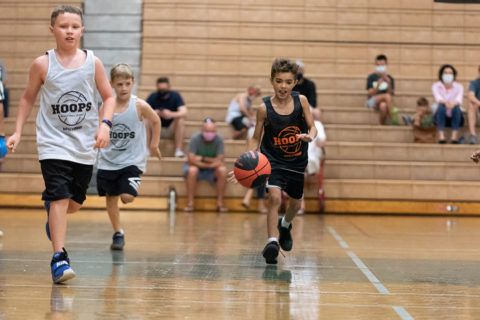
The width and height of the screenshot is (480, 320). I want to click on floor, so click(x=199, y=259).